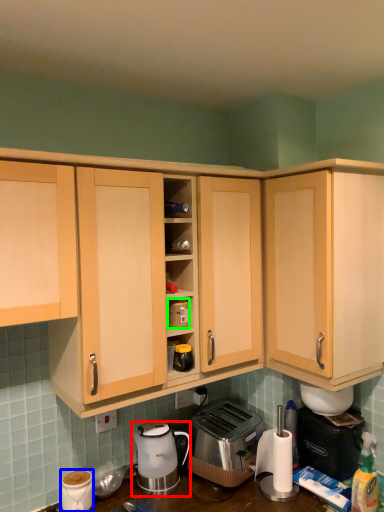
Question: Based on their relative distances, which object is nearer to coffee maker (highlighted by a red box)? Choose from coffee cup (highlighted by a blue box) and appliance (highlighted by a green box).

Choices:
 (A) coffee cup
 (B) appliance

Answer: (A)